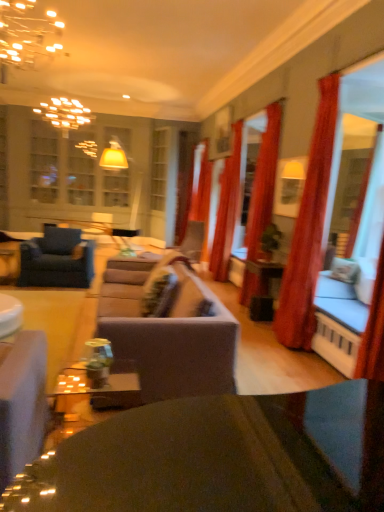
Question: In which direction should I rotate to look at velvet red curtain at center, the 2th curtain in the back-to-front sequence?

Choices:
 (A) right
 (B) left

Answer: (A)

Question: Is suede-like gray couch at center smaller than shiny black table at center, which is the 1th table in front-to-back order?

Choices:
 (A) no
 (B) yes

Answer: (A)

Question: Can you confirm if suede-like gray couch at center is thinner than shiny black table at center, which is the 1th table in front-to-back order?

Choices:
 (A) yes
 (B) no

Answer: (B)

Question: Can you see suede-like gray couch at center touching shiny black table at center, which is the 1th table in front-to-back order?

Choices:
 (A) no
 (B) yes

Answer: (A)

Question: Is suede-like gray couch at center at the right side of shiny black table at center, which is the 1th table in front-to-back order?

Choices:
 (A) no
 (B) yes

Answer: (A)

Question: Is suede-like gray couch at center bigger than shiny black table at center, marked as the first table in a right-to-left arrangement?

Choices:
 (A) yes
 (B) no

Answer: (A)

Question: From a real-world perspective, is suede-like gray couch at center below shiny black table at center, which is the 1th table in front-to-back order?

Choices:
 (A) no
 (B) yes

Answer: (B)

Question: Does shiny black table at center, marked as the first table in a right-to-left arrangement, have a smaller size compared to gold metallic chandelier at upper left?

Choices:
 (A) yes
 (B) no

Answer: (B)

Question: Does shiny black table at center, marked as the first table in a right-to-left arrangement, have a greater height compared to gold metallic chandelier at upper left?

Choices:
 (A) yes
 (B) no

Answer: (A)

Question: Is shiny black table at center, placed as the 2th table when sorted from left to right, positioned with its back to gold metallic chandelier at upper left?

Choices:
 (A) yes
 (B) no

Answer: (B)

Question: From a real-world perspective, is shiny black table at center, placed as the 2th table when sorted from left to right, positioned over gold metallic chandelier at upper left based on gravity?

Choices:
 (A) yes
 (B) no

Answer: (B)

Question: Does shiny black table at center, marked as the second table in a back-to-front arrangement, have a larger size compared to gold metallic chandelier at upper left?

Choices:
 (A) yes
 (B) no

Answer: (A)

Question: Is shiny black table at center, marked as the second table in a back-to-front arrangement, with gold metallic chandelier at upper left?

Choices:
 (A) yes
 (B) no

Answer: (B)

Question: Are velvet blue armchair at left and red velvet curtain at right, which ranks as the 3th curtain in back-to-front order, far apart?

Choices:
 (A) yes
 (B) no

Answer: (A)